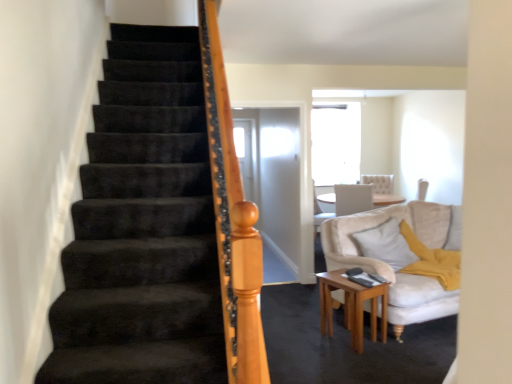
Question: Is soft white pillow at right closer to the viewer compared to light brown wooden side table at lower right?

Choices:
 (A) no
 (B) yes

Answer: (A)

Question: Does soft white pillow at right contain light brown wooden side table at lower right?

Choices:
 (A) yes
 (B) no

Answer: (B)

Question: Is the surface of soft white pillow at right in direct contact with light brown wooden side table at lower right?

Choices:
 (A) yes
 (B) no

Answer: (B)

Question: Can you confirm if soft white pillow at right is wider than light brown wooden side table at lower right?

Choices:
 (A) no
 (B) yes

Answer: (A)

Question: Can you confirm if soft white pillow at right is taller than light brown wooden side table at lower right?

Choices:
 (A) yes
 (B) no

Answer: (B)

Question: From the image's perspective, is soft white pillow at right located beneath light brown wooden side table at lower right?

Choices:
 (A) yes
 (B) no

Answer: (B)

Question: Does light brown wooden side table at lower right lie in front of soft white pillow at right?

Choices:
 (A) no
 (B) yes

Answer: (B)

Question: Is light brown wooden side table at lower right bigger than soft white pillow at right?

Choices:
 (A) no
 (B) yes

Answer: (A)

Question: Does light brown wooden side table at lower right have a lesser width compared to soft white pillow at right?

Choices:
 (A) yes
 (B) no

Answer: (B)

Question: Is the position of light brown wooden side table at lower right more distant than that of soft white pillow at right?

Choices:
 (A) no
 (B) yes

Answer: (A)

Question: From a real-world perspective, is light brown wooden side table at lower right under soft white pillow at right?

Choices:
 (A) yes
 (B) no

Answer: (A)

Question: From the image's perspective, is light brown wooden side table at lower right located beneath soft white pillow at right?

Choices:
 (A) yes
 (B) no

Answer: (A)

Question: Which is correct: soft white pillow at right is inside light brown wooden side table at lower right, or outside of it?

Choices:
 (A) outside
 (B) inside

Answer: (A)